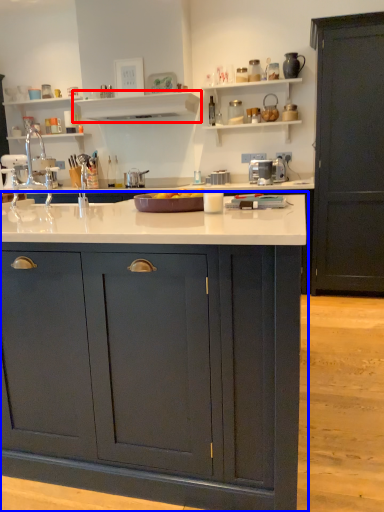
Question: Which object appears closest to the camera in this image, shelf (highlighted by a red box) or cabinetry (highlighted by a blue box)?

Choices:
 (A) shelf
 (B) cabinetry

Answer: (B)